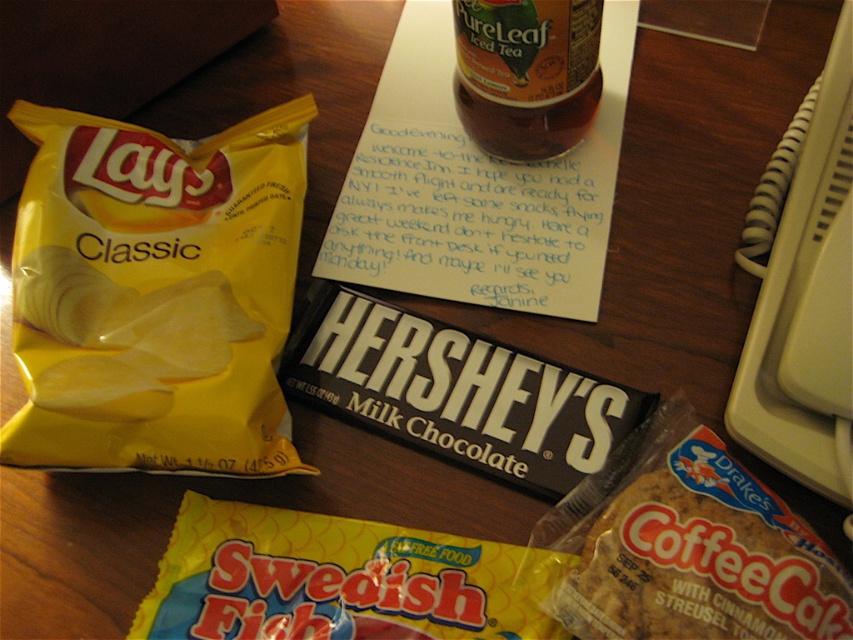
Does matte yellow chips at left appear under yellow/glossy swedish fish at lower center?

Actually, matte yellow chips at left is above yellow/glossy swedish fish at lower center.

Which is more to the right, matte yellow chips at left or yellow/glossy swedish fish at lower center?

yellow/glossy swedish fish at lower center is more to the right.

Between point (248, 317) and point (431, 573), which one is positioned behind?

Positioned behind is point (248, 317).

Locate an element on the screen. The width and height of the screenshot is (853, 640). matte yellow chips at left is located at coordinates (155, 294).

Does matte yellow chips at left lie behind translucent plastic bottle at upper center?

No, matte yellow chips at left is in front of translucent plastic bottle at upper center.

Who is positioned more to the right, matte yellow chips at left or translucent plastic bottle at upper center?

translucent plastic bottle at upper center is more to the right.

Measure the distance between point (97, 253) and camera.

Point (97, 253) is 19.72 inches away from camera.

You are a GUI agent. You are given a task and a screenshot of the screen. Output one action in this format:
    pyautogui.click(x=<x>, y=<y>)
    Task: Click on the matte yellow chips at left
    
    Given the screenshot: What is the action you would take?
    pyautogui.click(x=155, y=294)

Is brown crumbly cookie at lower right further to the viewer compared to translucent plastic bottle at upper center?

That is False.

Who is more forward, (593,557) or (502,77)?

Point (593,557) is in front.

Describe the element at coordinates (701, 563) in the screenshot. The image size is (853, 640). I see `brown crumbly cookie at lower right` at that location.

Image resolution: width=853 pixels, height=640 pixels. Identify the location of brown crumbly cookie at lower right. (701, 563).